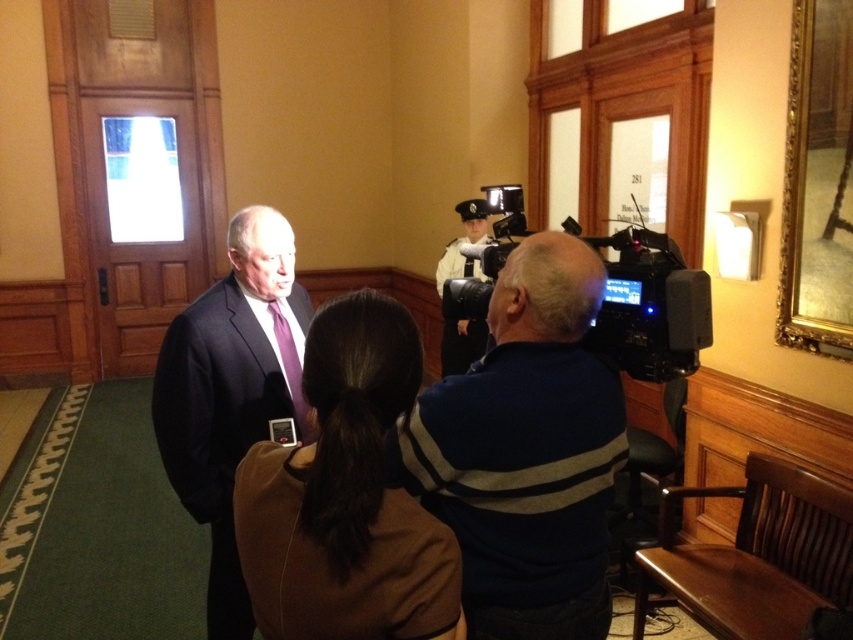
Who is more forward, (x=207, y=518) or (x=621, y=324)?

Point (x=621, y=324) is in front.

Does matte black suit at center have a lesser height compared to black plastic video camera at right?

No.

Describe the element at coordinates (231, 392) in the screenshot. I see `matte black suit at center` at that location.

Locate an element on the screen. matte black suit at center is located at coordinates (231, 392).

Does black plastic video camera at right have a lesser height compared to white uniform at center?

Yes, black plastic video camera at right is shorter than white uniform at center.

Which is behind, point (619, 252) or point (474, 200)?

Positioned behind is point (474, 200).

The image size is (853, 640). In order to click on black plastic video camera at right in this screenshot , I will do `click(648, 305)`.

Is point (498, 365) positioned before point (186, 336)?

Yes, it is in front of point (186, 336).

Is striped sweater at center smaller than matte black suit at center?

Correct, striped sweater at center occupies less space than matte black suit at center.

Locate an element on the screen. striped sweater at center is located at coordinates (526, 451).

Find the location of a particular element. striped sweater at center is located at coordinates (526, 451).